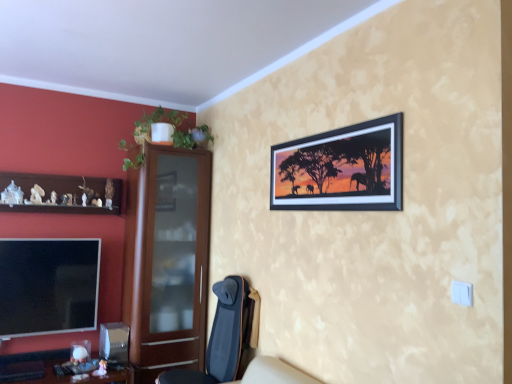
Locate an element on the screen. brown wooden dresser at left is located at coordinates (168, 261).

Describe the element at coordinates (41, 362) in the screenshot. I see `brushed wood desk at lower left` at that location.

What is the approximate width of brushed wood desk at lower left?

The width of brushed wood desk at lower left is 68.76 centimeters.

What do you see at coordinates (341, 168) in the screenshot? I see `black matte picture frame at upper right` at bounding box center [341, 168].

You are a GUI agent. You are given a task and a screenshot of the screen. Output one action in this format:
    pyautogui.click(x=<x>, y=<y>)
    Task: Click on the flat screen tv at lower left
    The width and height of the screenshot is (512, 384).
    Given the screenshot: What is the action you would take?
    pyautogui.click(x=48, y=286)

From the image's perspective, which is below, brown wooden dresser at left or brown wooden shelf at left?

brown wooden dresser at left is shown below in the image.

Based on the photo, considering the sizes of objects brown wooden dresser at left and brown wooden shelf at left in the image provided, who is shorter, brown wooden dresser at left or brown wooden shelf at left?

With less height is brown wooden shelf at left.

Can you confirm if brown wooden dresser at left is bigger than brown wooden shelf at left?

Correct, brown wooden dresser at left is larger in size than brown wooden shelf at left.

How distant is brown wooden dresser at left from brown wooden shelf at left?

They are 29.28 inches apart.

Can brown wooden shelf at left be found inside flat screen tv at lower left?

That's incorrect, brown wooden shelf at left is not inside flat screen tv at lower left.

Considering the positions of objects flat screen tv at lower left and brown wooden shelf at left in the image provided, who is behind, flat screen tv at lower left or brown wooden shelf at left?

flat screen tv at lower left is further away from the camera.

Considering the sizes of flat screen tv at lower left and brown wooden shelf at left in the image, is flat screen tv at lower left bigger or smaller than brown wooden shelf at left?

flat screen tv at lower left is smaller than brown wooden shelf at left.

Looking at this image, from a real-world perspective, which object stands above the other?

brown wooden shelf at left, from a real-world perspective.

Considering the sizes of brushed wood desk at lower left and brown wooden dresser at left in the image, is brushed wood desk at lower left taller or shorter than brown wooden dresser at left?

In the image, brushed wood desk at lower left appears to be shorter than brown wooden dresser at left.

Considering the positions of objects brushed wood desk at lower left and brown wooden dresser at left in the image provided, who is more to the right, brushed wood desk at lower left or brown wooden dresser at left?

brown wooden dresser at left is more to the right.

Does brushed wood desk at lower left come behind brown wooden dresser at left?

No, it is not.

Is brushed wood desk at lower left bigger or smaller than brown wooden dresser at left?

brushed wood desk at lower left is smaller than brown wooden dresser at left.

Based on the photo, between green leafy plant at upper left and flat screen tv at lower left, which one has larger width?

green leafy plant at upper left.

Consider the image. Is green leafy plant at upper left taller than flat screen tv at lower left?

In fact, green leafy plant at upper left may be shorter than flat screen tv at lower left.

How many degrees apart are the facing directions of green leafy plant at upper left and flat screen tv at lower left?

They differ by 1.81e-05 degrees in their facing directions.

Consider the image. Which object is further away from the camera taking this photo, green leafy plant at upper left or flat screen tv at lower left?

flat screen tv at lower left is behind.

Is black matte picture frame at upper right positioned with its back to brushed wood desk at lower left?

No, black matte picture frame at upper right's orientation is not away from brushed wood desk at lower left.

Considering the positions of objects black matte picture frame at upper right and brushed wood desk at lower left in the image provided, who is more to the right, black matte picture frame at upper right or brushed wood desk at lower left?

black matte picture frame at upper right.

In terms of height, does black matte picture frame at upper right look taller or shorter compared to brushed wood desk at lower left?

black matte picture frame at upper right is taller than brushed wood desk at lower left.

Is point (300, 159) positioned after point (63, 379)?

No, (300, 159) is in front of (63, 379).

Is flat screen tv at lower left bigger or smaller than green leafy plant at upper left?

flat screen tv at lower left is smaller than green leafy plant at upper left.

Considering the relative sizes of flat screen tv at lower left and green leafy plant at upper left in the image provided, is flat screen tv at lower left taller than green leafy plant at upper left?

Yes, flat screen tv at lower left is taller than green leafy plant at upper left.

Is flat screen tv at lower left thinner than green leafy plant at upper left?

Yes.

Measure the distance between flat screen tv at lower left and green leafy plant at upper left.

flat screen tv at lower left and green leafy plant at upper left are 3.60 feet apart from each other.

From the image's perspective, would you say brushed wood desk at lower left is shown under flat screen tv at lower left?

Yes, from the image's perspective, brushed wood desk at lower left is beneath flat screen tv at lower left.

In the image, is brushed wood desk at lower left positioned in front of or behind flat screen tv at lower left?

Visually, brushed wood desk at lower left is located in front of flat screen tv at lower left.

Considering the sizes of brushed wood desk at lower left and flat screen tv at lower left in the image, is brushed wood desk at lower left taller or shorter than flat screen tv at lower left?

In the image, brushed wood desk at lower left appears to be shorter than flat screen tv at lower left.

From the picture: Is brushed wood desk at lower left next to flat screen tv at lower left and touching it?

No, brushed wood desk at lower left is not next to flat screen tv at lower left.

Find the location of a particular element. dresser below the brown wooden shelf at left (from the image's perspective) is located at coordinates (168, 261).

Locate an element on the screen. This screenshot has width=512, height=384. cabinetry located above the flat screen tv at lower left (from the image's perspective) is located at coordinates (61, 193).

When comparing their distances from flat screen tv at lower left, does dark blue fabric chair at lower center or green leafy plant at upper left seem further?

dark blue fabric chair at lower center.

Based on their spatial positions, is brown wooden shelf at left or brown wooden dresser at left closer to dark blue fabric chair at lower center?

brown wooden dresser at left lies closer to dark blue fabric chair at lower center than the other object.

Which object lies nearer to the anchor point dark blue fabric chair at lower center, flat screen tv at lower left or black matte picture frame at upper right?

flat screen tv at lower left is closer to dark blue fabric chair at lower center.

Which object lies further to the anchor point dark blue fabric chair at lower center, green leafy plant at upper left or flat screen tv at lower left?

Among the two, green leafy plant at upper left is located further to dark blue fabric chair at lower center.

Estimate the real-world distances between objects in this image. Which object is further from brushed wood desk at lower left, dark blue fabric chair at lower center or black matte picture frame at upper right?

Among the two, black matte picture frame at upper right is located further to brushed wood desk at lower left.

From the picture: Based on their spatial positions, is green leafy plant at upper left or dark blue fabric chair at lower center further from black matte picture frame at upper right?

Among the two, green leafy plant at upper left is located further to black matte picture frame at upper right.

Estimate the real-world distances between objects in this image. Which object is further from flat screen tv at lower left, green leafy plant at upper left or brown wooden dresser at left?

green leafy plant at upper left.

From the image, which object appears to be farther from dark blue fabric chair at lower center, black matte picture frame at upper right or flat screen tv at lower left?

black matte picture frame at upper right lies further to dark blue fabric chair at lower center than the other object.

The height and width of the screenshot is (384, 512). In order to click on television that lies between green leafy plant at upper left and brushed wood desk at lower left from top to bottom in this screenshot , I will do `click(48, 286)`.

At what (x,y) coordinates should I click in order to perform the action: click on houseplant positioned between black matte picture frame at upper right and brown wooden dresser at left from near to far. Please return your answer as a coordinate pair (x, y). This screenshot has height=384, width=512. Looking at the image, I should click on (173, 128).

The width and height of the screenshot is (512, 384). I want to click on picture frame between green leafy plant at upper left and brushed wood desk at lower left vertically, so click(x=341, y=168).

Image resolution: width=512 pixels, height=384 pixels. What are the coordinates of `cabinetry between green leafy plant at upper left and brown wooden dresser at left in the vertical direction` in the screenshot? It's located at (61, 193).